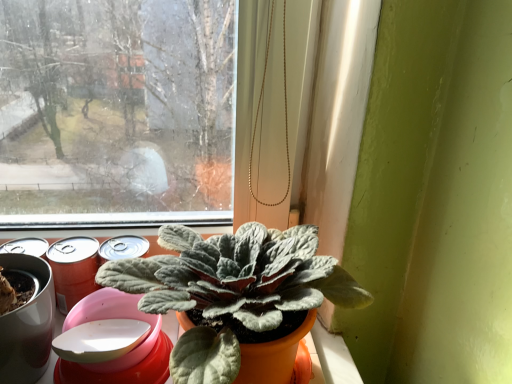
Question: From the image's perspective, is fuzzy green plant at center positioned above or below metallic red can at left?

Choices:
 (A) below
 (B) above

Answer: (A)

Question: From a real-world perspective, is fuzzy green plant at center above or below metallic red can at left?

Choices:
 (A) above
 (B) below

Answer: (A)

Question: Is fuzzy green plant at center bigger or smaller than metallic red can at left?

Choices:
 (A) big
 (B) small

Answer: (A)

Question: Considering their positions, is metallic red can at left located in front of or behind fuzzy green plant at center?

Choices:
 (A) front
 (B) behind

Answer: (B)

Question: Is point (92, 243) closer or farther from the camera than point (103, 273)?

Choices:
 (A) closer
 (B) farther

Answer: (B)

Question: In terms of width, does metallic red can at left look wider or thinner when compared to fuzzy green plant at center?

Choices:
 (A) wide
 (B) thin

Answer: (B)

Question: Visually, is metallic red can at left positioned to the left or to the right of fuzzy green plant at center?

Choices:
 (A) right
 (B) left

Answer: (B)